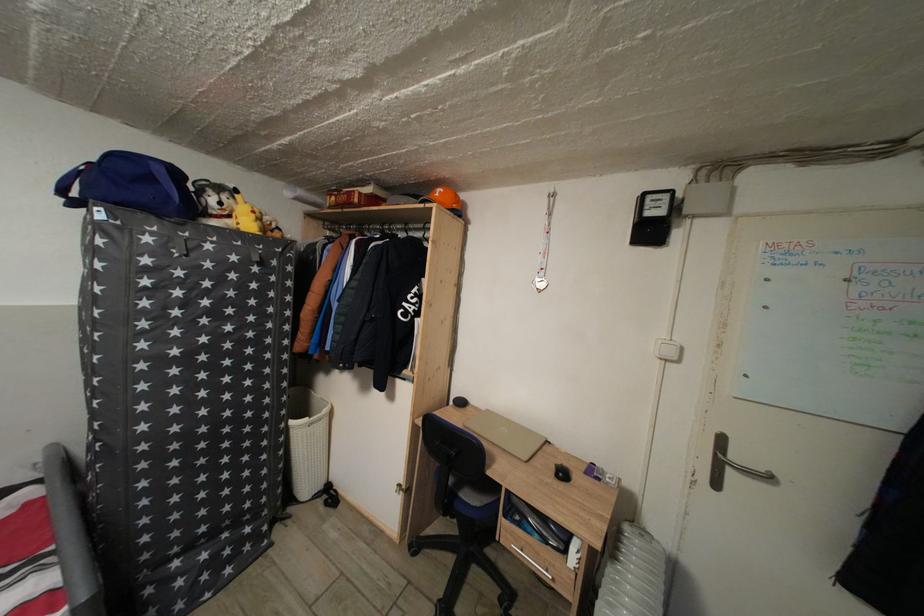
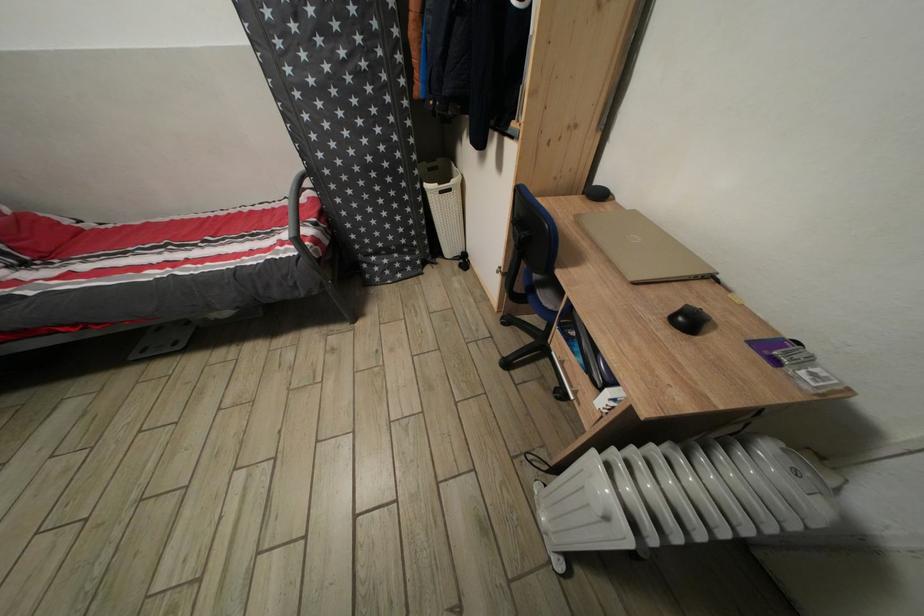
The point at (417, 554) is marked in the first image. Where is the corresponding point in the second image?

(509, 325)